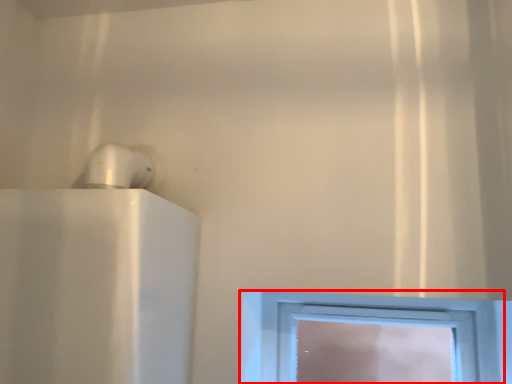
Question: From the image's perspective, what is the correct spatial relationship of window (annotated by the red box) in relation to appliance?

Choices:
 (A) below
 (B) above

Answer: (A)